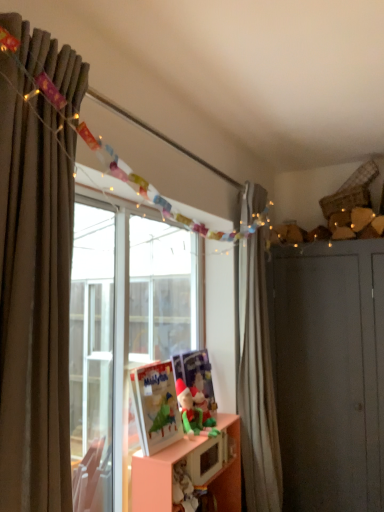
Identify the location of empty space that is to the right of matte plastic picture frame at center. The height and width of the screenshot is (512, 384). pos(180,443).